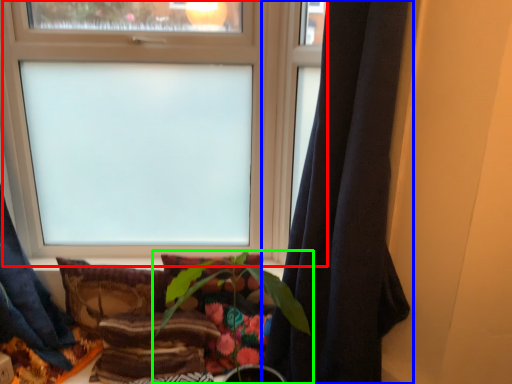
Question: Which is nearer to the window (highlighted by a red box)? curtain (highlighted by a blue box) or houseplant (highlighted by a green box).

Choices:
 (A) curtain
 (B) houseplant

Answer: (B)